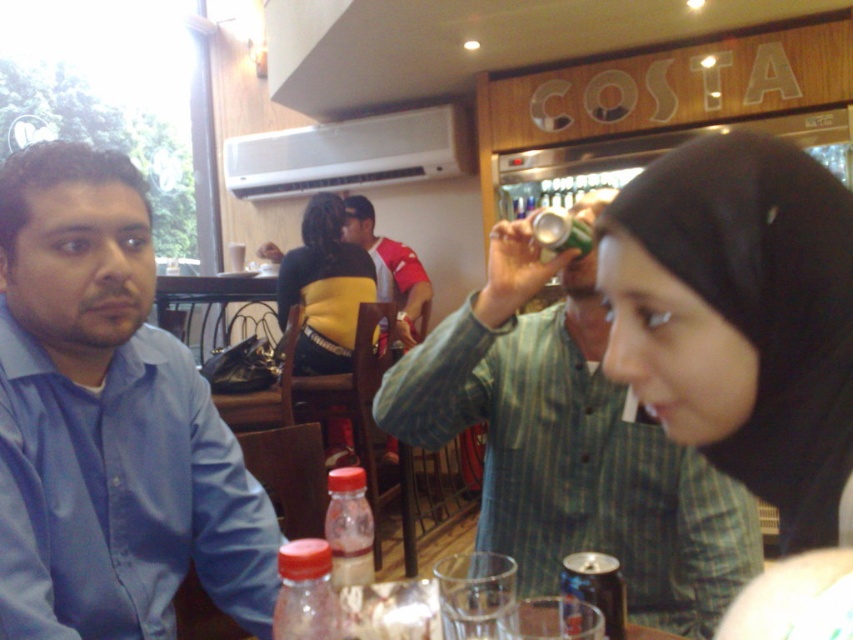
Based on the photo, you are a photographer taking a picture of the scene. You want to focus on the two points labeled as point (x=747, y=134) and point (x=390, y=269). Which point should you adjust your focus to first to ensure it appears sharp in the photo?

You should focus on point (x=747, y=134) first because it is closer to the camera than point (x=390, y=269), so it requires adjusting focus first to ensure sharpness.

You are a photographer taking a picture of the matte green shirt at center and the green matte can at upper center. Which object should you focus on first if you want to capture both in focus without moving the camera?

The matte green shirt at center is shorter than the green matte can at upper center, so you should focus on the green matte can at upper center first because it is farther away and has a greater depth of field requirement.

You are taking a photo of the scene and want to focus on both point (x=508, y=342) and point (x=281, y=564). Which point should you focus on first to ensure both are in focus?

You should focus on point (x=508, y=342) first because it is closer to the camera than point (x=281, y=564), ensuring both will be in focus when using depth of field.